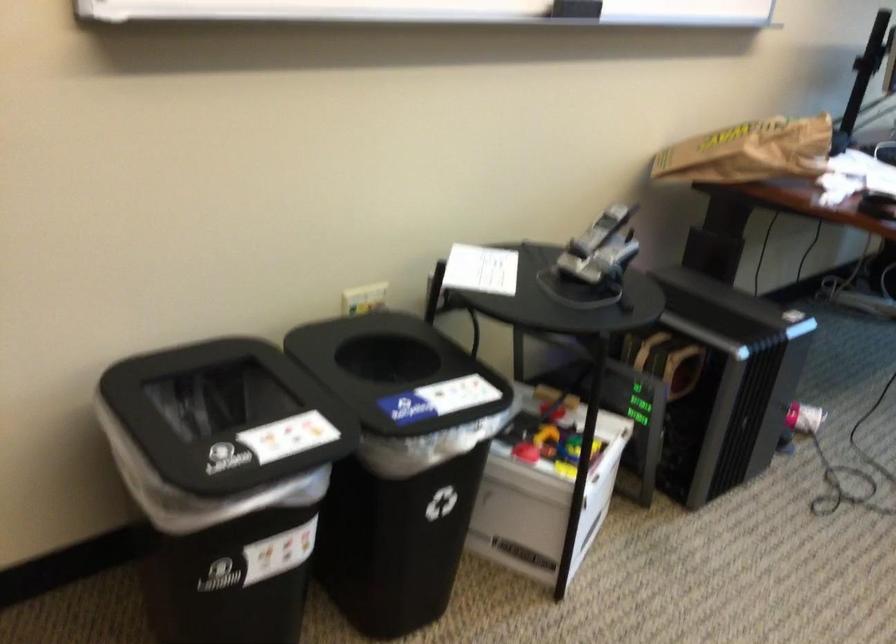
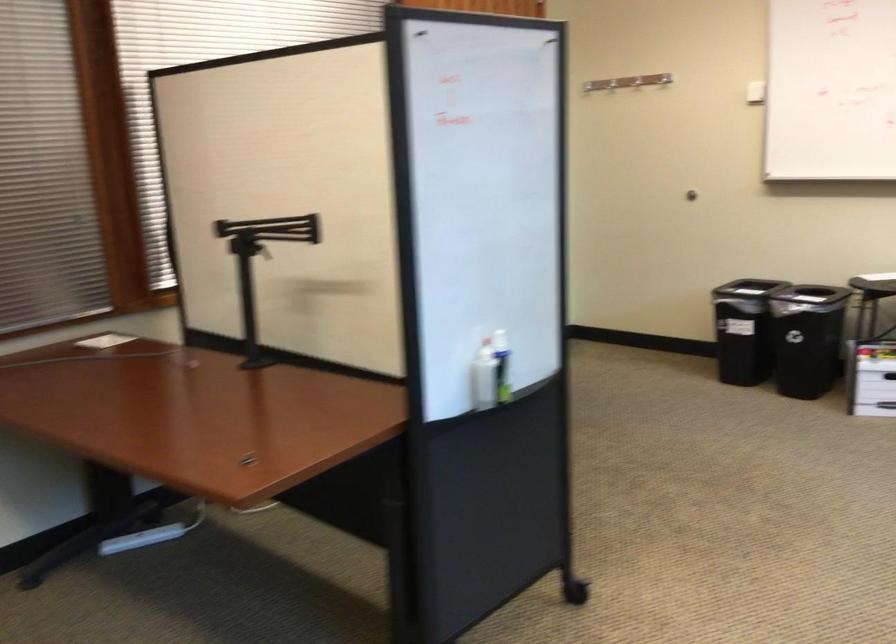
Locate, in the second image, the point that corresponds to point 780,536 in the first image.

(871, 379)